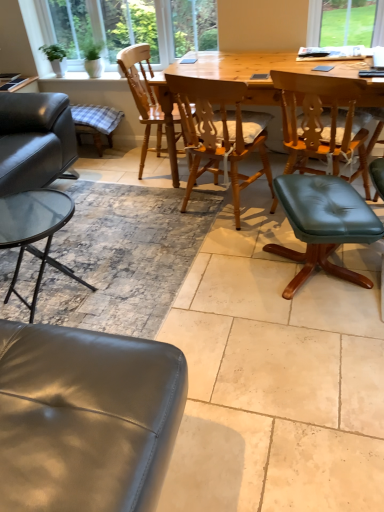
Question: From the image's perspective, would you say wooden chair at center, which ranks as the 1th chair in left-to-right order, is shown under teal leather stool at center-right, positioned as the 2th bar stool in back-to-front order?

Choices:
 (A) no
 (B) yes

Answer: (A)

Question: Is wooden chair at center, which ranks as the 1th chair in left-to-right order, at the left side of teal leather stool at center-right, which ranks as the 2th bar stool in left-to-right order?

Choices:
 (A) no
 (B) yes

Answer: (B)

Question: Considering the relative sizes of wooden chair at center, which ranks as the 1th chair in left-to-right order, and teal leather stool at center-right, the 1th bar stool from the bottom, in the image provided, is wooden chair at center, which ranks as the 1th chair in left-to-right order, bigger than teal leather stool at center-right, the 1th bar stool from the bottom,?

Choices:
 (A) no
 (B) yes

Answer: (B)

Question: Can you confirm if wooden chair at center, which is the 3th chair from right to left, is smaller than teal leather stool at center-right, positioned as the 2th bar stool in top-to-bottom order?

Choices:
 (A) yes
 (B) no

Answer: (B)

Question: Is wooden chair at center, which is the 3th chair from right to left, not inside teal leather stool at center-right, which ranks as the 2th bar stool in left-to-right order?

Choices:
 (A) yes
 (B) no

Answer: (A)

Question: Looking at their shapes, would you say wooden frame at upper left is wider or thinner than wooden chair at center, which ranks as the 1th chair in left-to-right order?

Choices:
 (A) wide
 (B) thin

Answer: (B)

Question: From the image's perspective, is wooden frame at upper left positioned above or below wooden chair at center, which ranks as the 1th chair in left-to-right order?

Choices:
 (A) above
 (B) below

Answer: (A)

Question: Considering the positions of point (94, 3) and point (175, 112), is point (94, 3) closer or farther from the camera than point (175, 112)?

Choices:
 (A) farther
 (B) closer

Answer: (A)

Question: From their relative heights in the image, would you say wooden frame at upper left is taller or shorter than wooden chair at center, which ranks as the 1th chair in left-to-right order?

Choices:
 (A) tall
 (B) short

Answer: (B)

Question: From their relative heights in the image, would you say wooden chair at center, which appears as the second chair when viewed from the left, is taller or shorter than green leather stool at center, the 1th chair positioned from the right?

Choices:
 (A) tall
 (B) short

Answer: (A)

Question: From the image's perspective, is wooden chair at center, the second chair in the right-to-left sequence, positioned above or below green leather stool at center, the 1th chair positioned from the right?

Choices:
 (A) below
 (B) above

Answer: (B)

Question: In the image, is wooden chair at center, which appears as the second chair when viewed from the left, positioned in front of or behind green leather stool at center, the third chair positioned from the left?

Choices:
 (A) behind
 (B) front

Answer: (A)

Question: Choose the correct answer: Is wooden chair at center, the second chair in the right-to-left sequence, inside green leather stool at center, the third chair positioned from the left, or outside it?

Choices:
 (A) outside
 (B) inside

Answer: (A)

Question: Relative to teal leather stool at center-right, positioned as the 2th bar stool in top-to-bottom order, is green leather stool at center, the third chair positioned from the left, in front or behind?

Choices:
 (A) front
 (B) behind

Answer: (B)

Question: Based on their sizes in the image, would you say green leather stool at center, the 1th chair positioned from the right, is bigger or smaller than teal leather stool at center-right, which is the first bar stool in right-to-left order?

Choices:
 (A) big
 (B) small

Answer: (A)